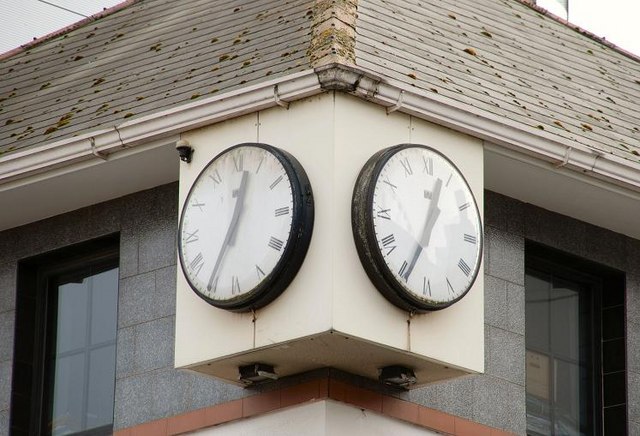
Identify the location of box built around the corner to hold clocks. The height and width of the screenshot is (436, 640). (336, 265).